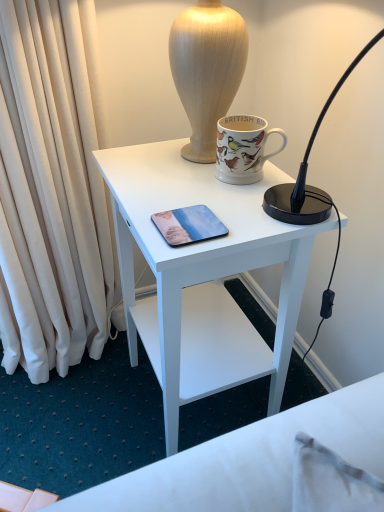
You are a GUI agent. You are given a task and a screenshot of the screen. Output one action in this format:
    pyautogui.click(x=<x>, y=<y>)
    Task: Click on the free space above white matte desk at center (from a real-world perspective)
    This screenshot has height=512, width=384.
    Given the screenshot: What is the action you would take?
    pyautogui.click(x=191, y=182)